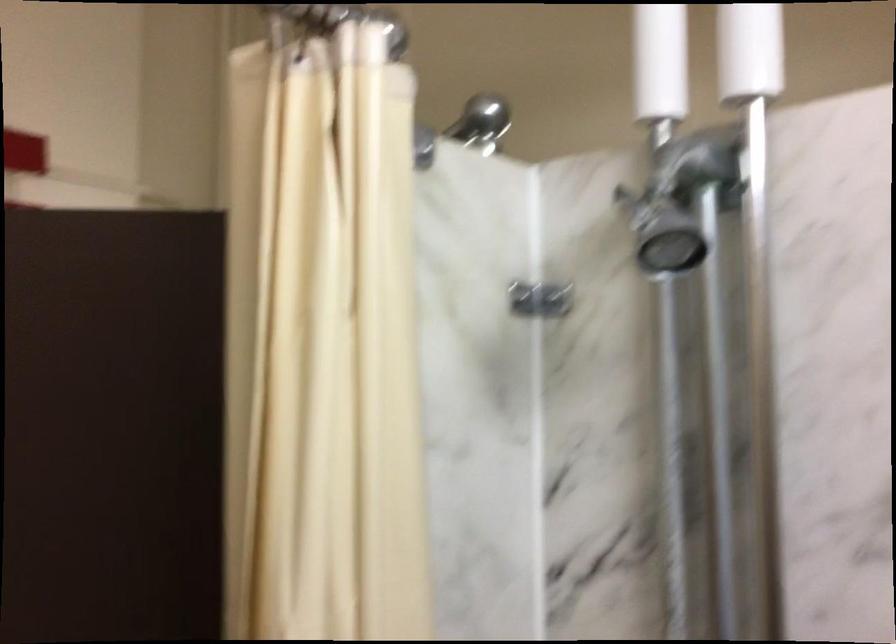
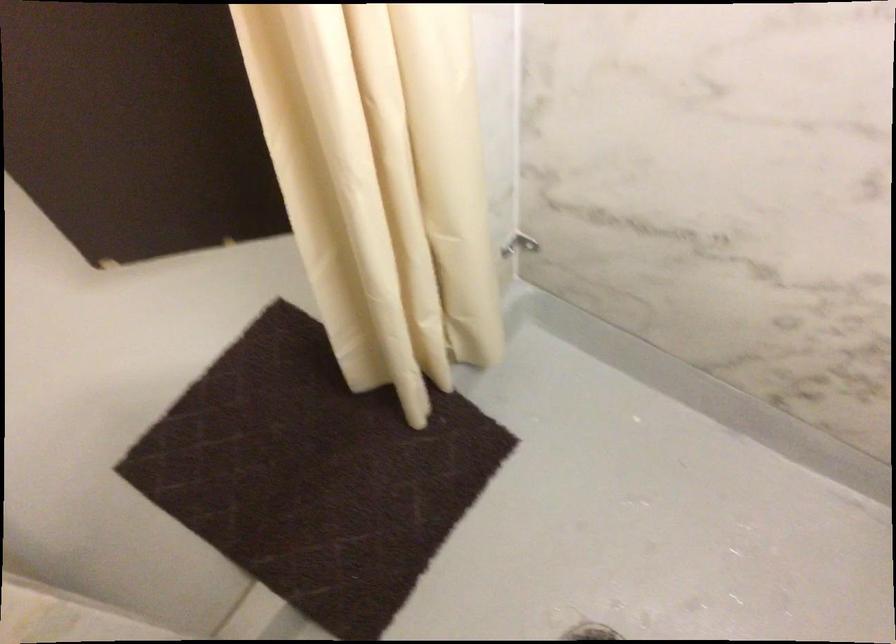
Question: What movement of the cameraman would produce the second image?

Choices:
 (A) Left
 (B) Right
 (C) Forward
 (D) Backward

Answer: (D)